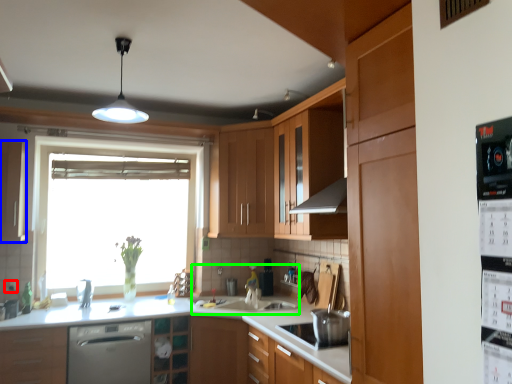
Question: Based on their relative distances, which object is nearer to electric outlet (highlighted by a red box)? Choose from cabinetry (highlighted by a blue box) and sink (highlighted by a green box).

Choices:
 (A) cabinetry
 (B) sink

Answer: (A)